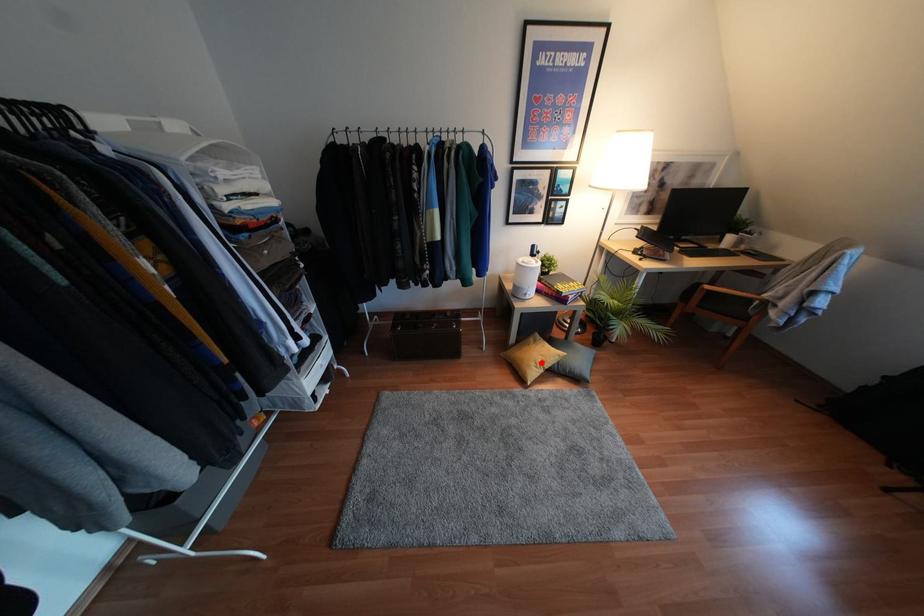
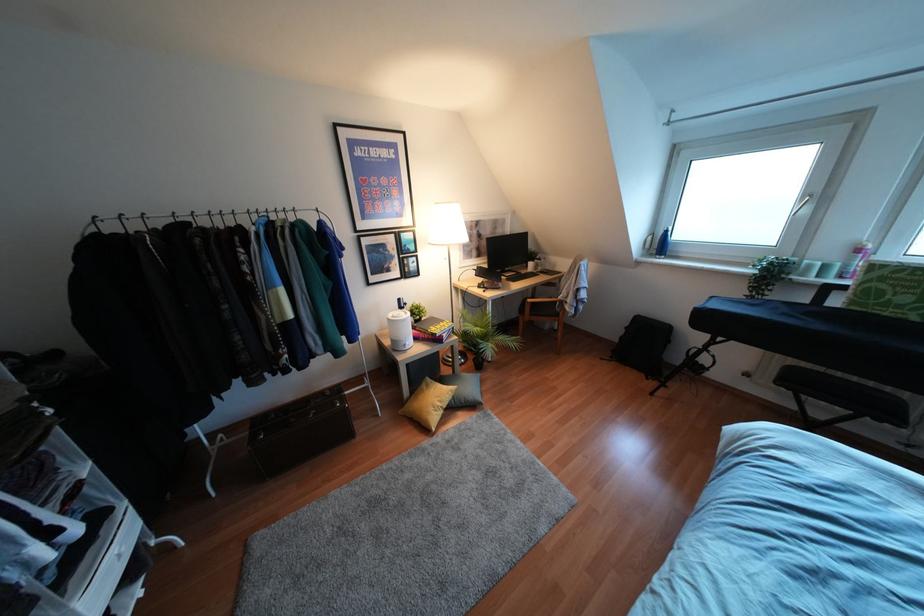
Question: A red point is marked in image1. In image2, is the corresponding 3D point closer to the camera or farther? Reply with the corresponding letter.

Choices:
 (A) The corresponding 3D point is closer.
 (B) The corresponding 3D point is farther.

Answer: (A)